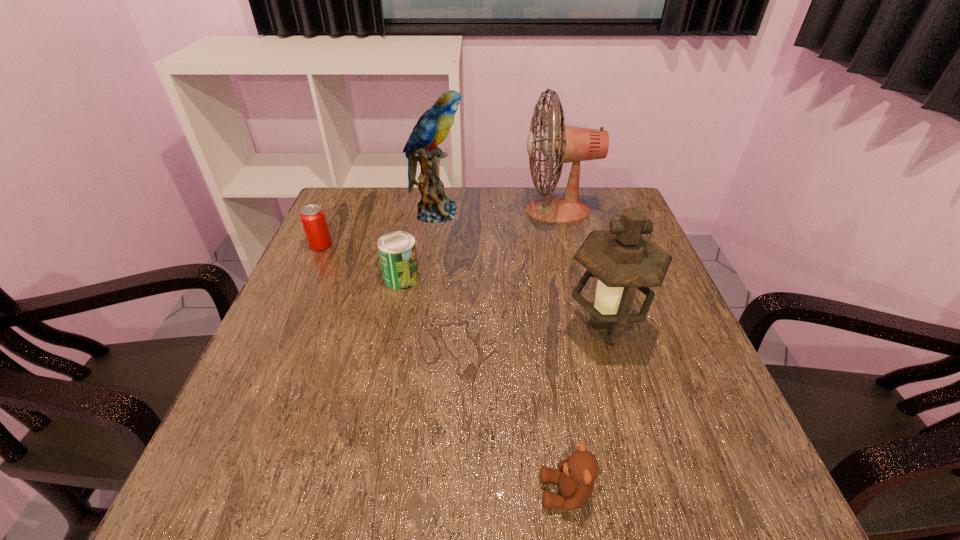
Locate an element on the screen. Image resolution: width=960 pixels, height=540 pixels. free space located 0.110m in front of the fan to direct airflow is located at coordinates (484, 211).

In order to click on free region located 0.170m in front of the fan to direct airflow in this screenshot , I will do `click(463, 211)`.

The height and width of the screenshot is (540, 960). I want to click on vacant space located 0.150m in front of the fan to direct airflow, so click(470, 211).

What are the coordinates of `vacant space located 0.220m on the front of the second nearest object` in the screenshot? It's located at (644, 470).

The image size is (960, 540). I want to click on free point located on the back of the leftmost object, so click(x=339, y=206).

I want to click on vacant space located 0.210m on the back of the nearer can, so click(414, 219).

Locate an element on the screen. The image size is (960, 540). free space located on the face of the teddy bear is located at coordinates (370, 492).

Where is `free space located on the face of the teddy bear`? free space located on the face of the teddy bear is located at coordinates (455, 492).

Image resolution: width=960 pixels, height=540 pixels. Find the location of `vacant point located 0.240m on the face of the teddy bear`. vacant point located 0.240m on the face of the teddy bear is located at coordinates (383, 492).

Locate an element on the screen. Image resolution: width=960 pixels, height=540 pixels. parrot at the far edge is located at coordinates (432, 128).